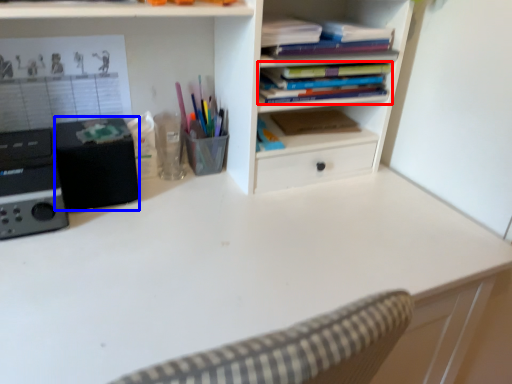
Question: Which object is further to the camera taking this photo, book (highlighted by a red box) or speaker (highlighted by a blue box)?

Choices:
 (A) book
 (B) speaker

Answer: (A)